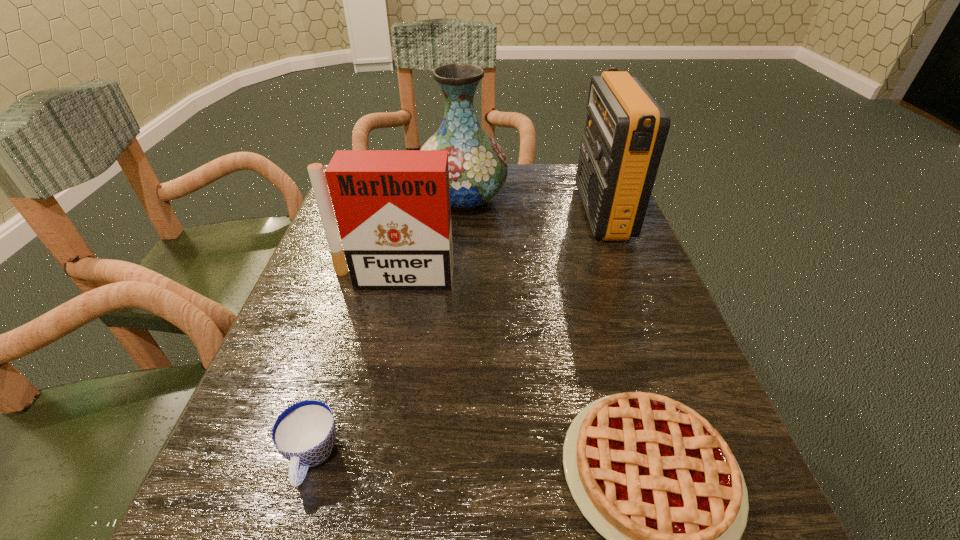
Locate an element on the screen. vase is located at coordinates (478, 169).

I want to click on radio receiver, so point(626,129).

The image size is (960, 540). Find the location of `cigarette case`. cigarette case is located at coordinates (392, 207).

At what (x,y) coordinates should I click in order to perform the action: click on the fourth tallest object. Please return your answer as a coordinate pair (x, y). Looking at the image, I should click on (304, 433).

You are a GUI agent. You are given a task and a screenshot of the screen. Output one action in this format:
    pyautogui.click(x=<x>, y=<y>)
    Task: Click on the free space located on the front of the vase
    The height and width of the screenshot is (540, 960).
    Given the screenshot: What is the action you would take?
    pyautogui.click(x=460, y=258)

Locate an element on the screen. vacant space positioned on the front-facing side of the radio receiver is located at coordinates (561, 212).

You are a GUI agent. You are given a task and a screenshot of the screen. Output one action in this format:
    pyautogui.click(x=<x>, y=<y>)
    Task: Click on the free spot located on the front-facing side of the radio receiver
    
    Given the screenshot: What is the action you would take?
    (453, 212)

Identify the location of vacant region located on the front-facing side of the radio receiver. (540, 212).

Where is `vacant space located on the front-facing side of the cigarette case`? The height and width of the screenshot is (540, 960). vacant space located on the front-facing side of the cigarette case is located at coordinates (365, 401).

This screenshot has width=960, height=540. In order to click on vase that is at the far edge in this screenshot , I will do `click(478, 169)`.